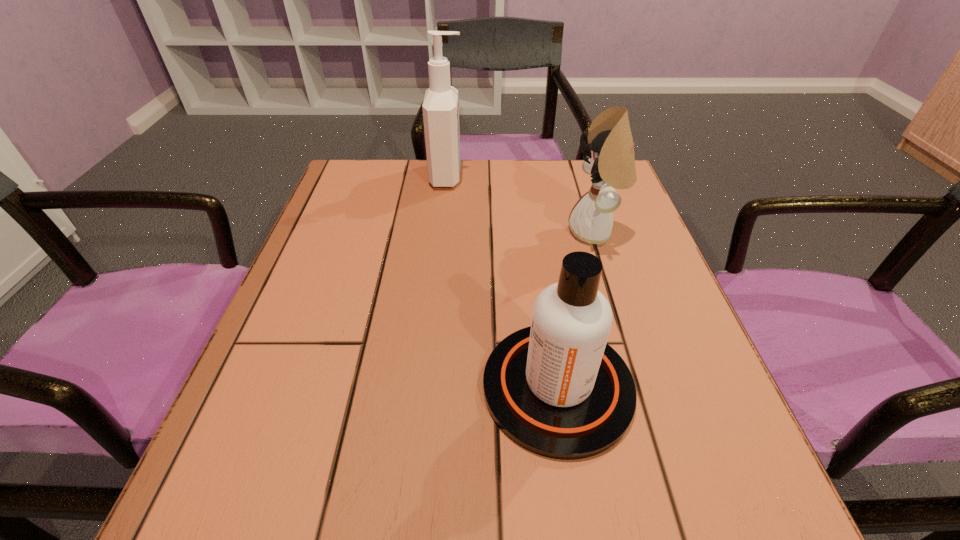
The height and width of the screenshot is (540, 960). Find the location of `cleansing agent at the far edge`. cleansing agent at the far edge is located at coordinates (440, 107).

What are the coordinates of `doll situated at the far edge` in the screenshot? It's located at (610, 161).

Where is `doll present at the right edge`? This screenshot has width=960, height=540. doll present at the right edge is located at coordinates (610, 161).

Find the location of a particular element. cleansing agent that is at the right edge is located at coordinates (557, 389).

This screenshot has height=540, width=960. Identify the location of object present at the far right corner. (610, 161).

In the image, there is a desktop. What are the coordinates of `vacant space at the far edge` in the screenshot? It's located at tap(483, 191).

Where is `vacant area at the left edge`? The image size is (960, 540). vacant area at the left edge is located at coordinates (292, 275).

Where is `blank space at the right edge of the desktop`? The image size is (960, 540). blank space at the right edge of the desktop is located at coordinates (643, 341).

Identify the location of free spot at the far left corner of the desktop. The image size is (960, 540). (357, 168).

You are a GUI agent. You are given a task and a screenshot of the screen. Output one action in this format:
    pyautogui.click(x=<x>, y=<y>)
    Task: Click on the free spot at the far right corner of the desktop
    
    Given the screenshot: What is the action you would take?
    pyautogui.click(x=560, y=160)